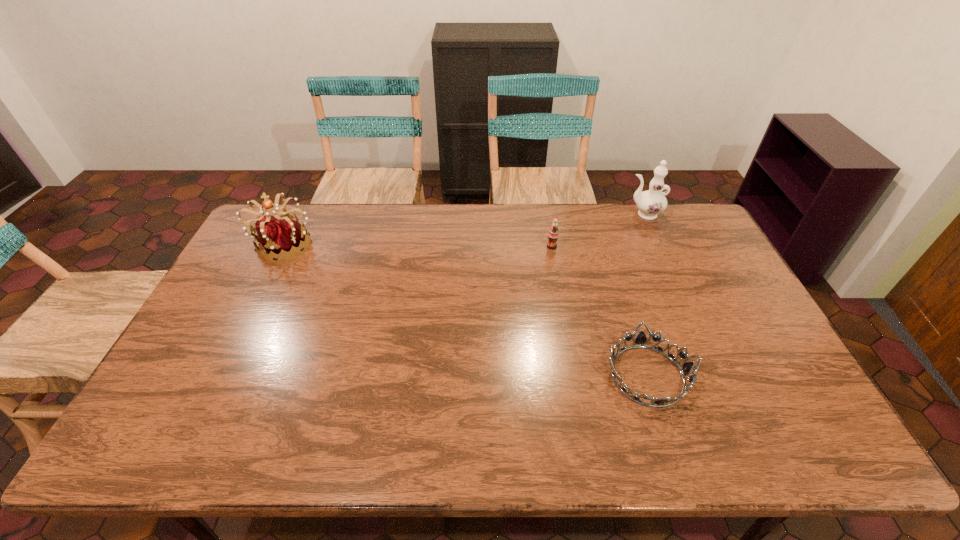
You are a GUI agent. You are given a task and a screenshot of the screen. Output one action in this format:
    pyautogui.click(x=<x>, y=<y>)
    Task: Click on the chinaware
    
    Given the screenshot: What is the action you would take?
    pyautogui.click(x=650, y=203)

Where is `the left tiara`? The image size is (960, 540). the left tiara is located at coordinates (282, 237).

Where is `the farther tiara`? This screenshot has width=960, height=540. the farther tiara is located at coordinates (282, 237).

Find the location of a particular element. The image size is (960, 540). the third object from right to left is located at coordinates (553, 234).

Identify the location of the third tallest object. (553, 234).

Where is `the shorter tiara`? The image size is (960, 540). the shorter tiara is located at coordinates (641, 339).

The image size is (960, 540). I want to click on the nearer tiara, so click(x=641, y=339).

This screenshot has height=540, width=960. What are the coordinates of `vacant space located at the spout of the farthest object` in the screenshot? It's located at (558, 214).

Locate an element on the screen. The height and width of the screenshot is (540, 960). blank space located 0.330m at the spout of the farthest object is located at coordinates (537, 214).

Locate an element on the screen. vacant space located at the spout of the farthest object is located at coordinates (520, 214).